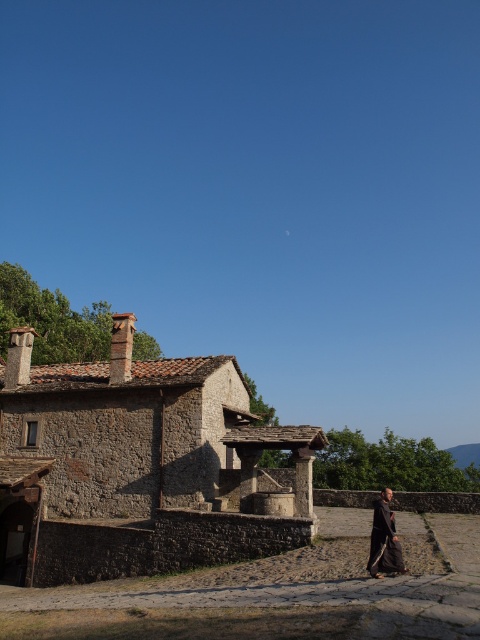
Question: Among these points, which one is nearest to the camera?

Choices:
 (A) (22, 333)
 (B) (384, 490)

Answer: (A)

Question: Does rustic stone village at lower left appear on the left side of dark brown woolen robe at lower right?

Choices:
 (A) yes
 (B) no

Answer: (A)

Question: Does rustic stone village at lower left have a smaller size compared to dark brown woolen robe at lower right?

Choices:
 (A) yes
 (B) no

Answer: (B)

Question: Which point is farther from the camera taking this photo?

Choices:
 (A) (244, 545)
 (B) (392, 550)

Answer: (A)

Question: Is rustic stone village at lower left thinner than dark brown woolen robe at lower right?

Choices:
 (A) yes
 (B) no

Answer: (B)

Question: Which object appears farthest from the camera in this image?

Choices:
 (A) dark brown woolen robe at lower right
 (B) rustic stone village at lower left

Answer: (B)